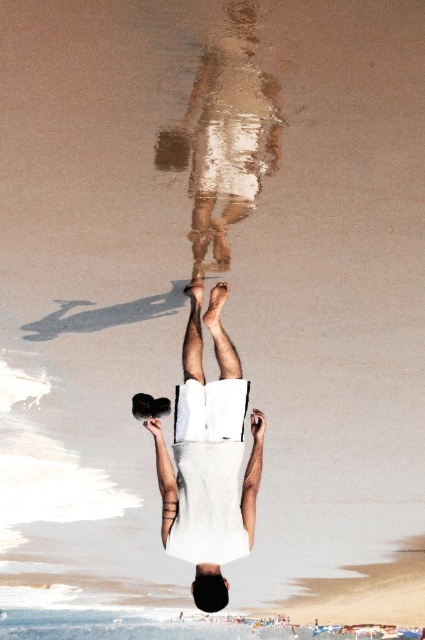
You are a photographer trying to capture the reflection in the water. Which object should you focus on first to ensure the reflection is clear, the smooth white skin at center or the shiny metallic legs at center?

You should focus on the smooth white skin at center first because the shiny metallic legs at center is behind it, so the reflection of the smooth white skin at center will be more prominent and clearer in the water.

You are a photographer capturing the reflection in the water. Which object, the smooth white skin at center or the shiny metallic legs at center, appears higher in the reflection?

The shiny metallic legs at center appear higher in the reflection because the smooth white skin at center is below them in the actual scene, so their reflection would mirror that position.